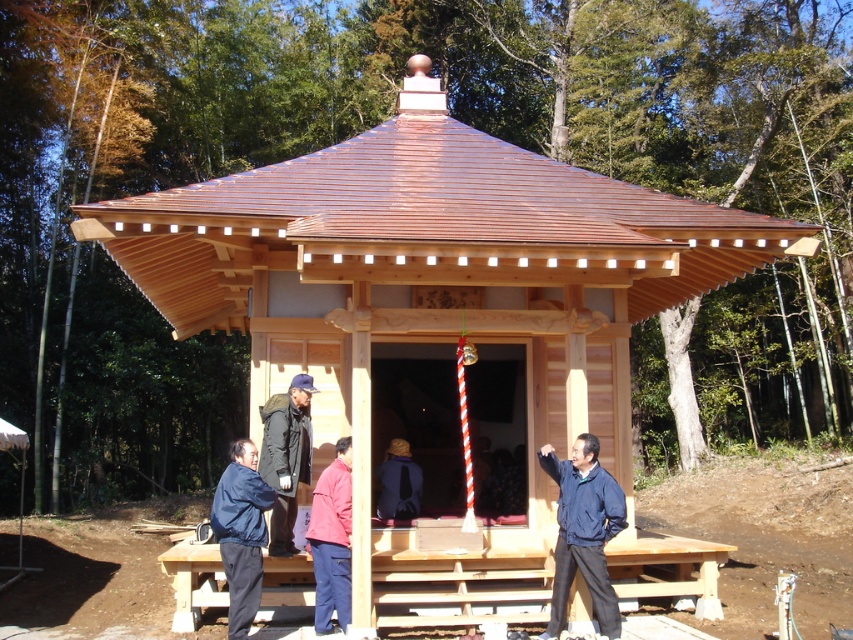
Is blue fabric jacket at lower left to the left of reddish-brown wooden person at center from the viewer's perspective?

Correct, you'll find blue fabric jacket at lower left to the left of reddish-brown wooden person at center.

Between blue fabric jacket at lower left and reddish-brown wooden person at center, which one is positioned lower?

Positioned lower is blue fabric jacket at lower left.

What do you see at coordinates (241, 532) in the screenshot?
I see `blue fabric jacket at lower left` at bounding box center [241, 532].

This screenshot has width=853, height=640. What are the coordinates of `blue fabric jacket at lower left` in the screenshot? It's located at (241, 532).

Between blue fabric jacket at center and blue fabric jacket at lower left, which one has less height?

Standing shorter between the two is blue fabric jacket at lower left.

Is blue fabric jacket at center positioned behind blue fabric jacket at lower left?

Yes, blue fabric jacket at center is behind blue fabric jacket at lower left.

Where is `blue fabric jacket at center`? blue fabric jacket at center is located at coordinates coord(583,531).

How far apart are red fabric jacket at center and reddish-brown wooden person at center?

They are 5.63 feet apart.

Looking at this image, does red fabric jacket at center have a smaller size compared to reddish-brown wooden person at center?

No, red fabric jacket at center is not smaller than reddish-brown wooden person at center.

Measure the distance between red fabric jacket at center and camera.

red fabric jacket at center and camera are 7.63 meters apart.

Image resolution: width=853 pixels, height=640 pixels. I want to click on red fabric jacket at center, so click(x=331, y=540).